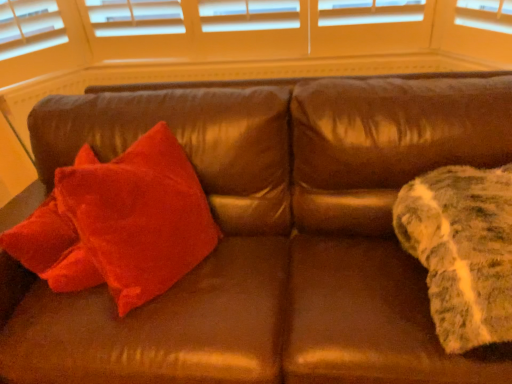
At what (x,y) coordinates should I click in order to perform the action: click on velvet red pillow at left. Please return your answer as a coordinate pair (x, y). Looking at the image, I should click on (139, 216).

Describe the element at coordinates (139, 216) in the screenshot. The height and width of the screenshot is (384, 512). I see `velvet red pillow at left` at that location.

Describe the element at coordinates (462, 250) in the screenshot. I see `fuzzy white blanket at right` at that location.

I want to click on fuzzy white blanket at right, so click(x=462, y=250).

At what (x,y) coordinates should I click in order to perform the action: click on velvet red pillow at left. Please return your answer as a coordinate pair (x, y). The image size is (512, 384). Looking at the image, I should click on (139, 216).

Which is more to the right, velvet red pillow at left or fuzzy white blanket at right?

fuzzy white blanket at right.

Is velvet red pillow at left further to the viewer compared to fuzzy white blanket at right?

Yes, velvet red pillow at left is behind fuzzy white blanket at right.

Considering the points (210, 219) and (403, 244), which point is behind, point (210, 219) or point (403, 244)?

Point (210, 219)

From the image's perspective, which one is positioned lower, velvet red pillow at left or fuzzy white blanket at right?

fuzzy white blanket at right, from the image's perspective.

From the picture: From a real-world perspective, which is physically above, velvet red pillow at left or fuzzy white blanket at right?

In real-world perspective, fuzzy white blanket at right is above.

In terms of width, does velvet red pillow at left look wider or thinner when compared to fuzzy white blanket at right?

Considering their sizes, velvet red pillow at left looks slimmer than fuzzy white blanket at right.

Considering the relative sizes of velvet red pillow at left and fuzzy white blanket at right in the image provided, is velvet red pillow at left taller than fuzzy white blanket at right?

Correct, velvet red pillow at left is much taller as fuzzy white blanket at right.

Which of these two, velvet red pillow at left or fuzzy white blanket at right, is bigger?

velvet red pillow at left is bigger.

Is velvet red pillow at left completely or partially outside of fuzzy white blanket at right?

Yes, velvet red pillow at left is outside of fuzzy white blanket at right.

Is velvet red pillow at left not near fuzzy white blanket at right?

No.

Is velvet red pillow at left positioned with its back to fuzzy white blanket at right?

No.

What are the coordinates of `blanket lying below the velvet red pillow at left (from the image's perspective)` in the screenshot? It's located at (462, 250).

Considering the positions of objects fuzzy white blanket at right and velvet red pillow at left in the image provided, who is more to the right, fuzzy white blanket at right or velvet red pillow at left?

From the viewer's perspective, fuzzy white blanket at right appears more on the right side.

Which object is further away from the camera taking this photo, fuzzy white blanket at right or velvet red pillow at left?

→ velvet red pillow at left is more distant.

Is point (471, 184) closer or farther from the camera than point (187, 186)?

Point (471, 184).

Consider the image. From the image's perspective, is fuzzy white blanket at right under velvet red pillow at left?

Yes.

Looking at this image, from a real-world perspective, between fuzzy white blanket at right and velvet red pillow at left, who is vertically higher?

From a 3D spatial view, fuzzy white blanket at right is above.

From the picture: Between fuzzy white blanket at right and velvet red pillow at left, which one has larger width?

Wider between the two is fuzzy white blanket at right.

Can you confirm if fuzzy white blanket at right is shorter than velvet red pillow at left?

Correct, fuzzy white blanket at right is not as tall as velvet red pillow at left.

Who is bigger, fuzzy white blanket at right or velvet red pillow at left?

With larger size is velvet red pillow at left.

Is fuzzy white blanket at right completely or partially outside of velvet red pillow at left?

fuzzy white blanket at right is positioned outside velvet red pillow at left.

Are fuzzy white blanket at right and velvet red pillow at left beside each other?

No, fuzzy white blanket at right is not beside velvet red pillow at left.

Could you tell me if fuzzy white blanket at right is turned towards velvet red pillow at left?

No, fuzzy white blanket at right is not facing towards velvet red pillow at left.

How much distance is there between fuzzy white blanket at right and velvet red pillow at left?

fuzzy white blanket at right and velvet red pillow at left are 73.55 centimeters apart from each other.

This screenshot has height=384, width=512. I want to click on blanket on the right of velvet red pillow at left, so click(462, 250).

Find the location of a particular element. This screenshot has height=384, width=512. throw pillow on the left side of fuzzy white blanket at right is located at coordinates (139, 216).

At what (x,y) coordinates should I click in order to perform the action: click on blanket below the velvet red pillow at left (from the image's perspective). Please return your answer as a coordinate pair (x, y). Looking at the image, I should click on (462, 250).